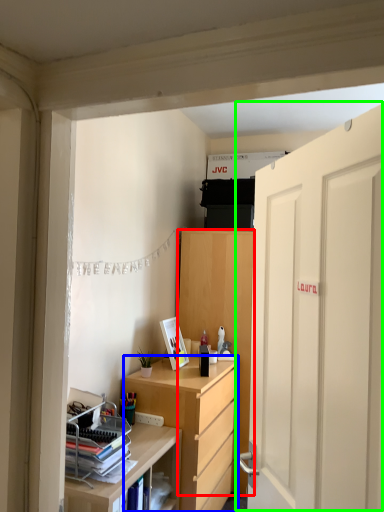
Question: Considering the real-world distances, which object is closest to cabinetry (highlighted by a red box)? desk (highlighted by a blue box) or door (highlighted by a green box).

Choices:
 (A) desk
 (B) door

Answer: (A)